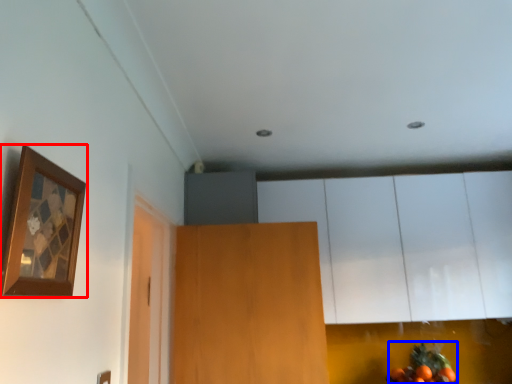
Question: Which of the following is the farthest to the observer, picture frame (highlighted by a red box) or fruit (highlighted by a blue box)?

Choices:
 (A) picture frame
 (B) fruit

Answer: (B)